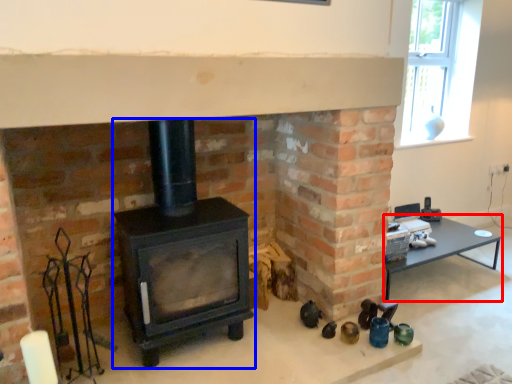
Question: Which point is closer to the camera, table (highlighted by a red box) or wood burning stove (highlighted by a blue box)?

Choices:
 (A) table
 (B) wood burning stove

Answer: (B)